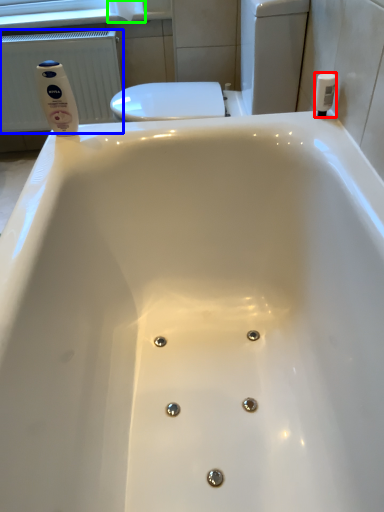
Question: Which object is the closest to the toiletry (highlighted by a red box)? Choose among these: radiator (highlighted by a blue box) or toilet paper (highlighted by a green box).

Choices:
 (A) radiator
 (B) toilet paper

Answer: (B)